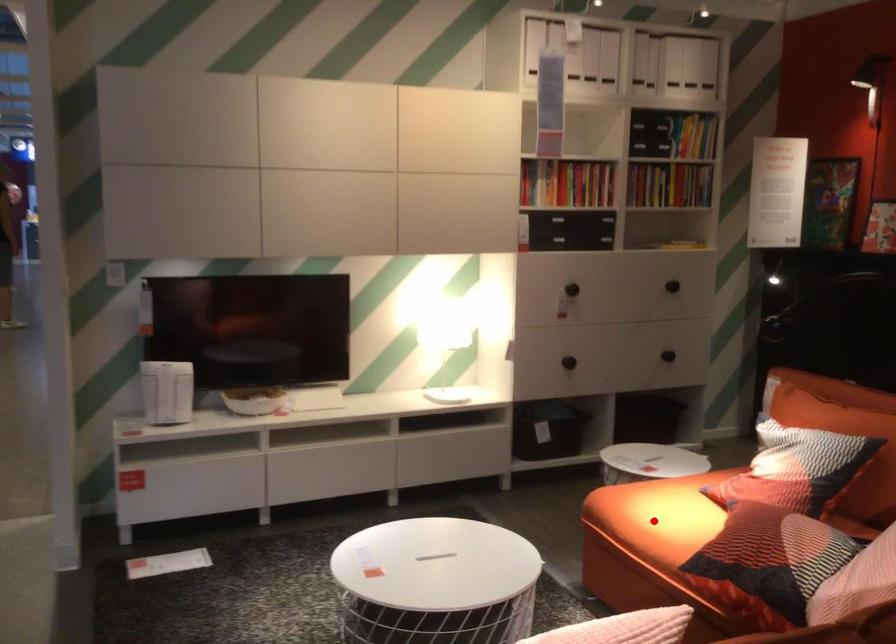
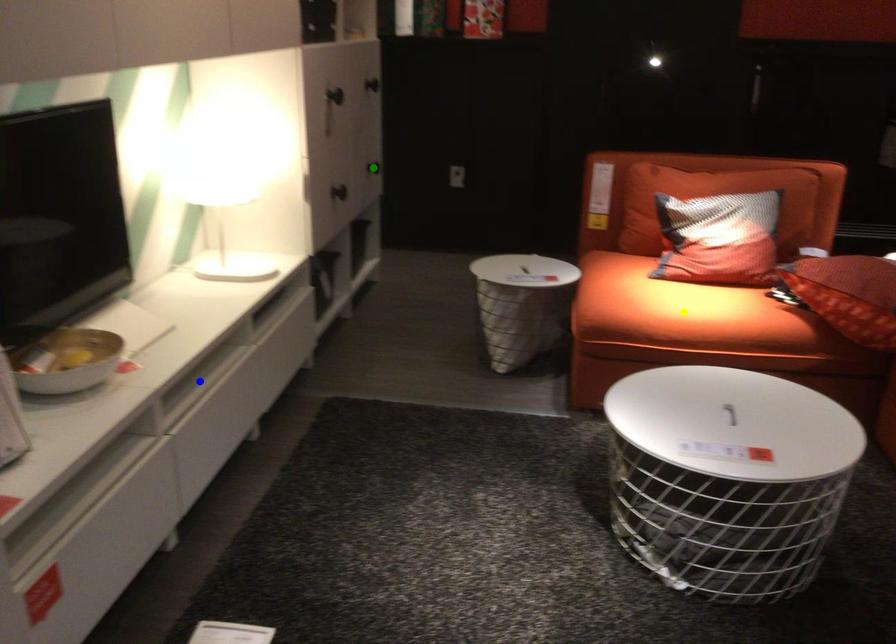
Question: I am providing you with two images of the same scene from different viewpoints. A red point is marked on the first image. You are given multiple points on the second image. Which mark in image 2 goes with the point in image 1?

Choices:
 (A) green point
 (B) blue point
 (C) yellow point

Answer: (C)